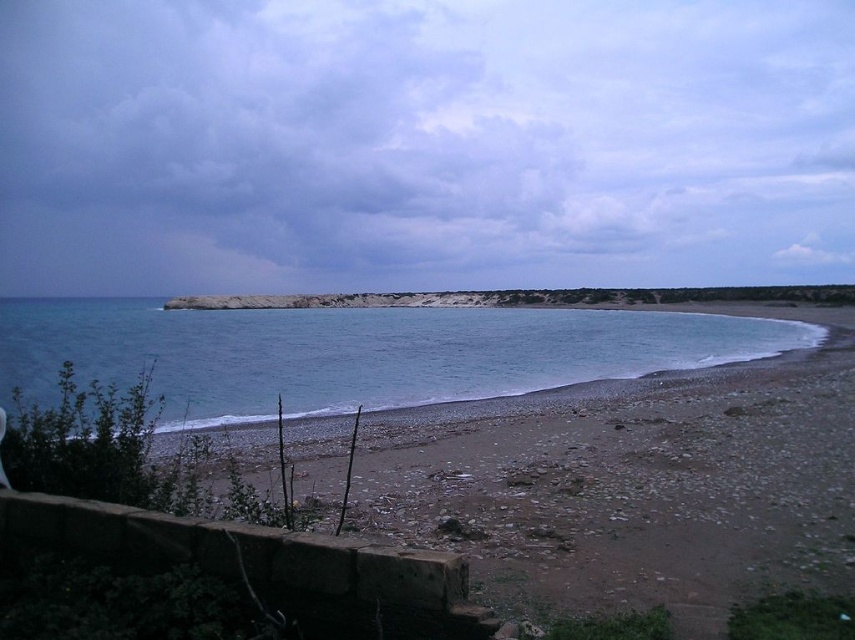
You are a hiker who wants to cross from the smooth sand beach at lower right to the blue water at lower left. Considering their heights, which path would require less effort to climb?

The smooth sand beach at lower right has a lesser height compared to the blue water at lower left, so crossing from the smooth sand beach at lower right to the blue water at lower left would require less effort since the beach is lower in elevation.

You are standing on the beach and want to walk to the blue water at lower left without stepping on the smooth sand beach at lower right. Which direction should you go to avoid it?

You should walk to the left side of blue water at lower left to avoid the smooth sand beach at lower right, since the smooth sand beach at lower right is positioned on the right side of blue water at lower left.

You are standing at the center of the image and want to walk to the smooth sand beach at lower right. Which direction should you move relative to your current position?

Since the smooth sand beach at lower right is located at coordinates approximately 0.756 on the x and 0.743 on the y axis, you should move diagonally towards the lower right direction to reach it.